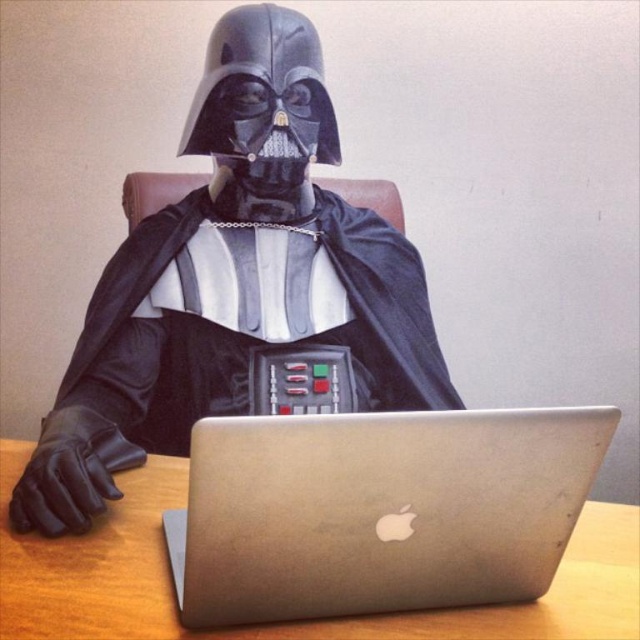
Who is lower down, metallic silver laptop at center or silver metallic laptop at center?

silver metallic laptop at center is lower down.

Which is behind, point (196, 406) or point (522, 561)?

The point (196, 406) is more distant.

Is point (262, 13) in front of point (417, 524)?

No.

This screenshot has height=640, width=640. I want to click on metallic silver laptop at center, so click(232, 282).

Who is higher up, silver metallic laptop at center or black matte robe at center?

black matte robe at center is higher up.

Is silver metallic laptop at center thinner than black matte robe at center?

Correct, silver metallic laptop at center's width is less than black matte robe at center's.

Who is more forward, (195, 522) or (168, 278)?

Point (195, 522) is more forward.

Image resolution: width=640 pixels, height=640 pixels. Identify the location of silver metallic laptop at center. (x=378, y=509).

Measure the distance between metallic silver laptop at center and camera.

metallic silver laptop at center is 25.84 inches from camera.

Is the position of metallic silver laptop at center less distant than that of black matte robe at center?

Yes.

Is point (449, 384) farther from viewer compared to point (272, 316)?

Yes, it is behind point (272, 316).

Find the location of `metallic silver laptop at center`. metallic silver laptop at center is located at coordinates (232, 282).